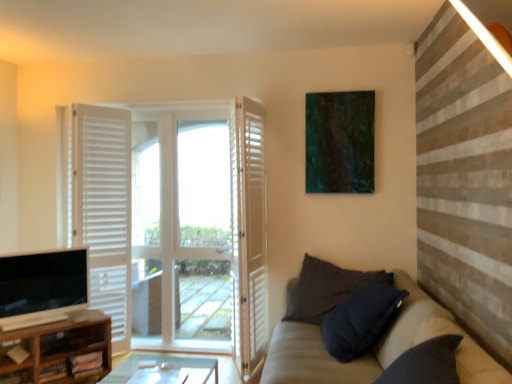
Question: Relative to teal matte painting at upper center, is brown wood cabinet at lower left in front or behind?

Choices:
 (A) front
 (B) behind

Answer: (A)

Question: Does point (68, 365) appear closer or farther from the camera than point (367, 183)?

Choices:
 (A) farther
 (B) closer

Answer: (B)

Question: Based on their relative distances, which object is nearer to the brown wood cabinet at lower left?

Choices:
 (A) dark textured pillow at lower right
 (B) white wooden door at center, the 2th door when ordered from right to left
 (C) white wooden door at left, acting as the 3th door starting from the right
 (D) matte black tv at lower left
 (E) beige fabric couch at lower right

Answer: (D)

Question: Which object is the farthest from the teal matte painting at upper center?

Choices:
 (A) white wooden door at left, the first door when ordered from left to right
 (B) dark textured pillow at lower right
 (C) beige fabric couch at lower right
 (D) white wooden door at center, the 2th door when ordered from right to left
 (E) brown wood cabinet at lower left

Answer: (E)